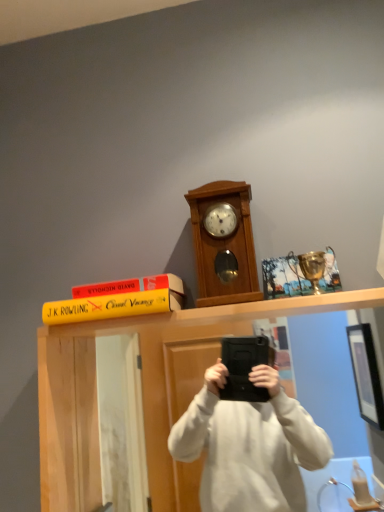
Question: Is yellow matte book at upper center aimed at wooden clock at center?

Choices:
 (A) yes
 (B) no

Answer: (B)

Question: Does yellow matte book at upper center have a smaller size compared to wooden clock at center?

Choices:
 (A) no
 (B) yes

Answer: (B)

Question: Does yellow matte book at upper center appear on the left side of wooden clock at center?

Choices:
 (A) no
 (B) yes

Answer: (B)

Question: Is yellow matte book at upper center far from wooden clock at center?

Choices:
 (A) yes
 (B) no

Answer: (B)

Question: From a real-world perspective, is yellow matte book at upper center below wooden clock at center?

Choices:
 (A) no
 (B) yes

Answer: (B)

Question: Considering the positions of yellow matte book at upper center and wooden clock at center in the image, is yellow matte book at upper center wider or thinner than wooden clock at center?

Choices:
 (A) wide
 (B) thin

Answer: (A)

Question: In the image, is yellow matte book at upper center on the left side or the right side of wooden clock at center?

Choices:
 (A) right
 (B) left

Answer: (B)

Question: Is yellow matte book at upper center situated inside wooden clock at center or outside?

Choices:
 (A) inside
 (B) outside

Answer: (B)

Question: Is yellow matte book at upper center in front of or behind wooden clock at center in the image?

Choices:
 (A) front
 (B) behind

Answer: (A)

Question: In terms of size, does yellow matte book at upper center appear bigger or smaller than wooden clock at center?

Choices:
 (A) small
 (B) big

Answer: (A)

Question: Is yellow matte book at upper center taller or shorter than wooden clock at center?

Choices:
 (A) tall
 (B) short

Answer: (B)

Question: From a real-world perspective, relative to wooden clock at center, is yellow matte book at upper center vertically above or below?

Choices:
 (A) above
 (B) below

Answer: (B)

Question: From the image's perspective, relative to wooden clock at center, is yellow matte book at upper center above or below?

Choices:
 (A) below
 (B) above

Answer: (A)

Question: Do you think wooden clock at center is within yellow matte book at upper center, or outside of it?

Choices:
 (A) outside
 (B) inside

Answer: (A)

Question: From a real-world perspective, is wooden clock at center physically located above or below yellow matte book at upper center?

Choices:
 (A) below
 (B) above

Answer: (B)